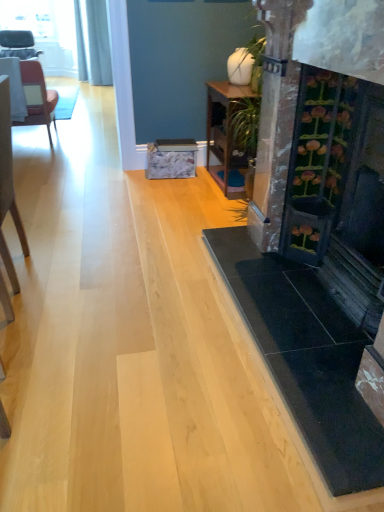
This screenshot has height=512, width=384. Find the location of `vacant area that lies between wooden table at center, which is the first table in right-to-left order, and light brown wooden chair at left, which is the 3th chair in left-to-right order`. vacant area that lies between wooden table at center, which is the first table in right-to-left order, and light brown wooden chair at left, which is the 3th chair in left-to-right order is located at coordinates tap(146, 216).